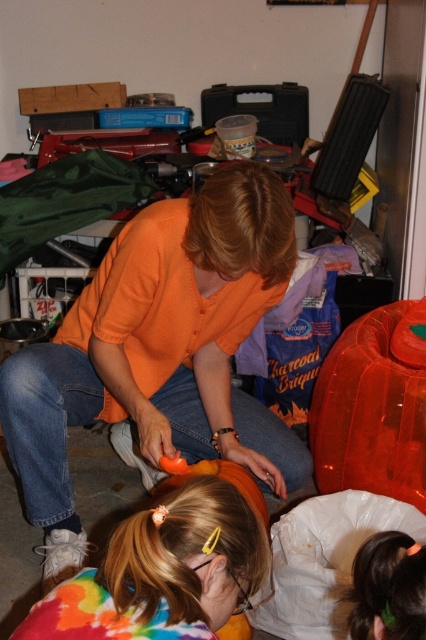
Is tie-dye fabric at lower left above multicolored tie-dye shirt at lower center?

Yes, tie-dye fabric at lower left is above multicolored tie-dye shirt at lower center.

Is point (181, 596) less distant than point (385, 580)?

Yes, point (181, 596) is in front of point (385, 580).

Locate an element on the screen. tie-dye fabric at lower left is located at coordinates (164, 572).

Is orange matte shirt at center to the left of tie-dye fabric at lower left from the viewer's perspective?

Incorrect, orange matte shirt at center is not on the left side of tie-dye fabric at lower left.

Who is positioned more to the right, orange matte shirt at center or tie-dye fabric at lower left?

orange matte shirt at center is more to the right.

Between point (218, 301) and point (98, 602), which one is positioned in front?

Point (98, 602) is more forward.

The image size is (426, 640). Find the location of `orange matte shirt at center`. orange matte shirt at center is located at coordinates (158, 353).

Is point (236, 433) closer to viewer compared to point (359, 570)?

That is False.

Can you confirm if orange matte shirt at center is wider than multicolored tie-dye shirt at lower center?

Correct, the width of orange matte shirt at center exceeds that of multicolored tie-dye shirt at lower center.

Where is `orange matte shirt at center`? This screenshot has width=426, height=640. orange matte shirt at center is located at coordinates (158, 353).